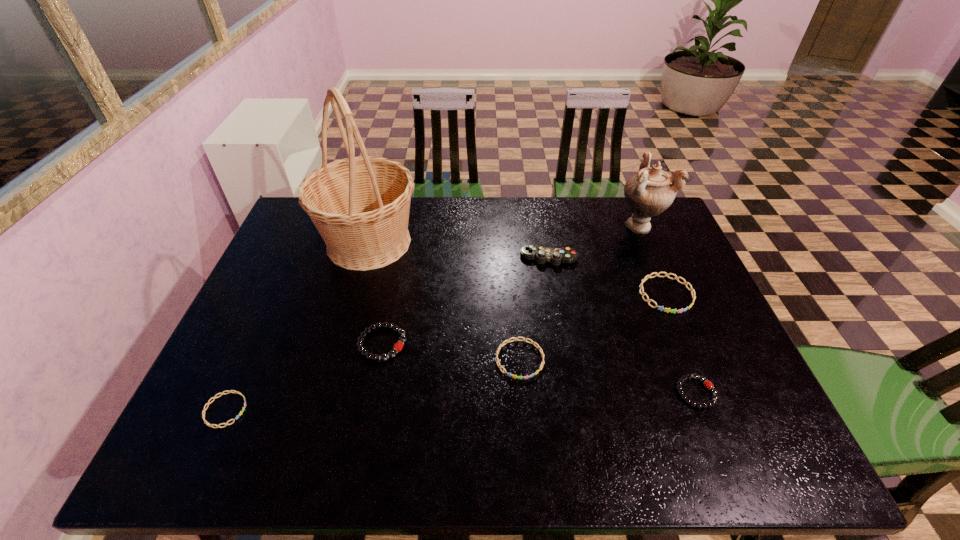
Where is `vacant space at the far edge of the desktop`? vacant space at the far edge of the desktop is located at coordinates [x=466, y=240].

Identify the location of free space at the near edge. This screenshot has height=540, width=960. (514, 454).

Where is `free location at the left edge`? This screenshot has height=540, width=960. free location at the left edge is located at coordinates (265, 366).

In the image, there is a desktop. Identify the location of vacant space at the right edge. (678, 241).

You are a GUI agent. You are given a task and a screenshot of the screen. Output one action in this format:
    pyautogui.click(x=<x>, y=<y>)
    Task: Click on the free spot between the sixth shortest object and the nearest blue bracelet
    This screenshot has width=960, height=540.
    Given the screenshot: What is the action you would take?
    pyautogui.click(x=387, y=334)

Where is `unoccupied area between the second blue bracelet from right to left and the second bracelet from left to right`? This screenshot has height=540, width=960. unoccupied area between the second blue bracelet from right to left and the second bracelet from left to right is located at coordinates (451, 352).

The width and height of the screenshot is (960, 540). Find the location of `vacant space that is in between the seventh shortest object and the sixth shortest object`. vacant space that is in between the seventh shortest object and the sixth shortest object is located at coordinates (594, 241).

You are a GUI agent. You are given a task and a screenshot of the screen. Output one action in this format:
    pyautogui.click(x=<x>, y=<y>)
    Task: Click on the empty space between the second nearest blue bracelet and the second bracelet from left to right
    The width and height of the screenshot is (960, 540).
    Given the screenshot: What is the action you would take?
    pyautogui.click(x=451, y=352)

Image resolution: width=960 pixels, height=540 pixels. I want to click on empty space between the second smallest blue bracelet and the third tallest object, so click(x=534, y=308).

Where is `vacant area that lies between the seventh shortest object and the farthest blue bracelet`? The image size is (960, 540). vacant area that lies between the seventh shortest object and the farthest blue bracelet is located at coordinates (653, 260).